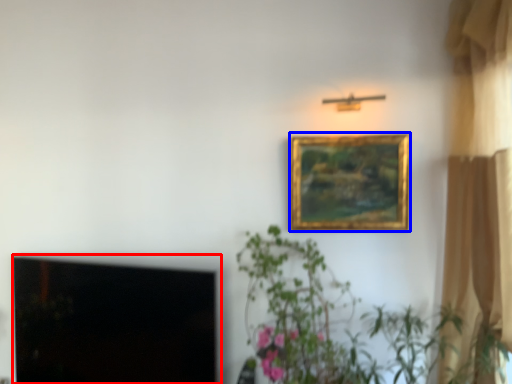
Question: Which point is further to the camera, window screen (highlighted by a red box) or picture frame (highlighted by a blue box)?

Choices:
 (A) window screen
 (B) picture frame

Answer: (B)